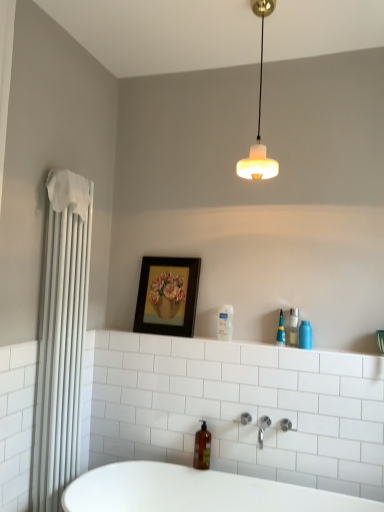
Question: Looking at their shapes, would you say white frosted glass lampshade at upper center is wider or thinner than clear plastic bottle at center, the first toiletry when ordered from left to right?

Choices:
 (A) wide
 (B) thin

Answer: (A)

Question: From a real-world perspective, relative to clear plastic bottle at center, the first toiletry when ordered from left to right, is white frosted glass lampshade at upper center vertically above or below?

Choices:
 (A) below
 (B) above

Answer: (B)

Question: Estimate the real-world distances between objects in this image. Which object is closer to the white frosted glass lampshade at upper center?

Choices:
 (A) blue glossy bottle at upper right, acting as the first toiletry starting from the right
 (B) clear glass bottle at upper right, which is the third toiletry from left to right
 (C) wooden framed painting at center
 (D) silver metallic faucet at lower center
 (E) white fabric towel at left

Answer: (B)

Question: Considering the real-world distances, which object is closest to the clear glass bottle at upper right, which is the third toiletry from left to right?

Choices:
 (A) translucent plastic pen at upper right, placed as the second toiletry when sorted from left to right
 (B) white frosted glass lampshade at upper center
 (C) white fabric towel at left
 (D) brown glass soap dispenser at lower center
 (E) blue glossy bottle at upper right, acting as the first toiletry starting from the right

Answer: (E)